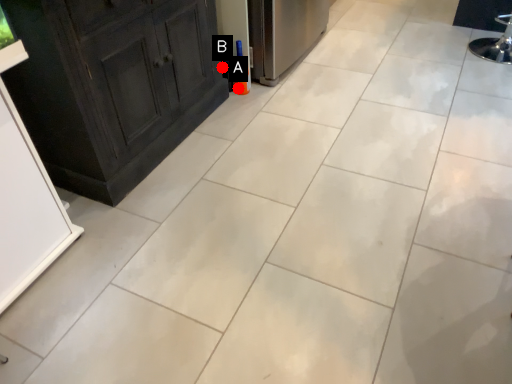
Question: Two points are circled on the image, labeled by A and B beside each circle. Which point is closer to the camera?

Choices:
 (A) A is closer
 (B) B is closer

Answer: (B)